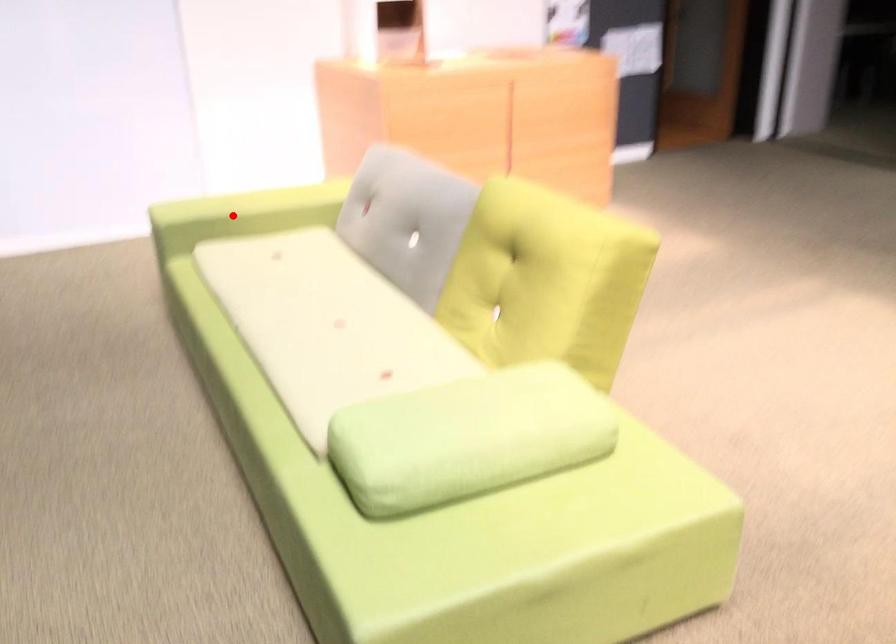
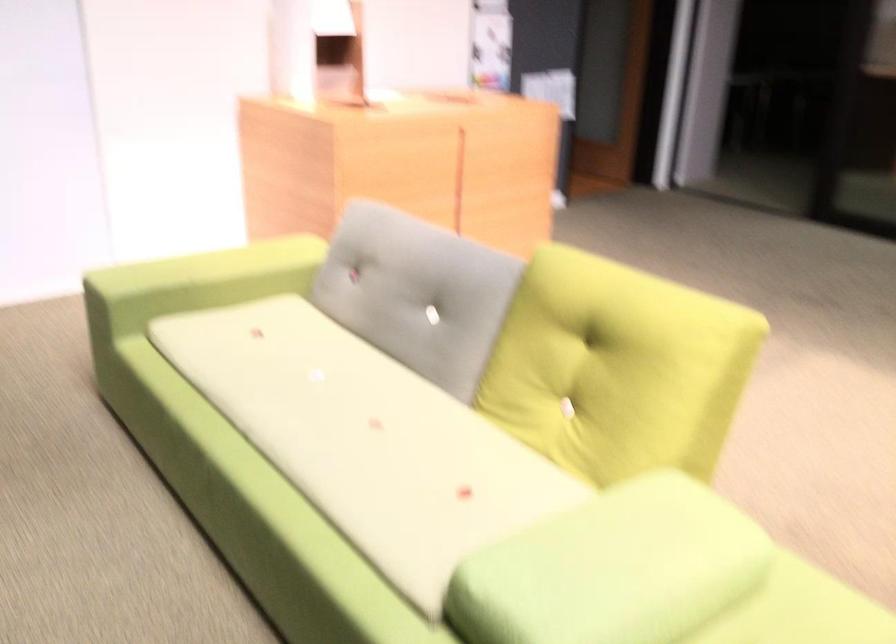
Question: I am providing you with two images of the same scene from different viewpoints. Given a red point in image1, look at the same physical point in image2. Is it:

Choices:
 (A) Closer to the viewpoint
 (B) Farther from the viewpoint

Answer: (A)